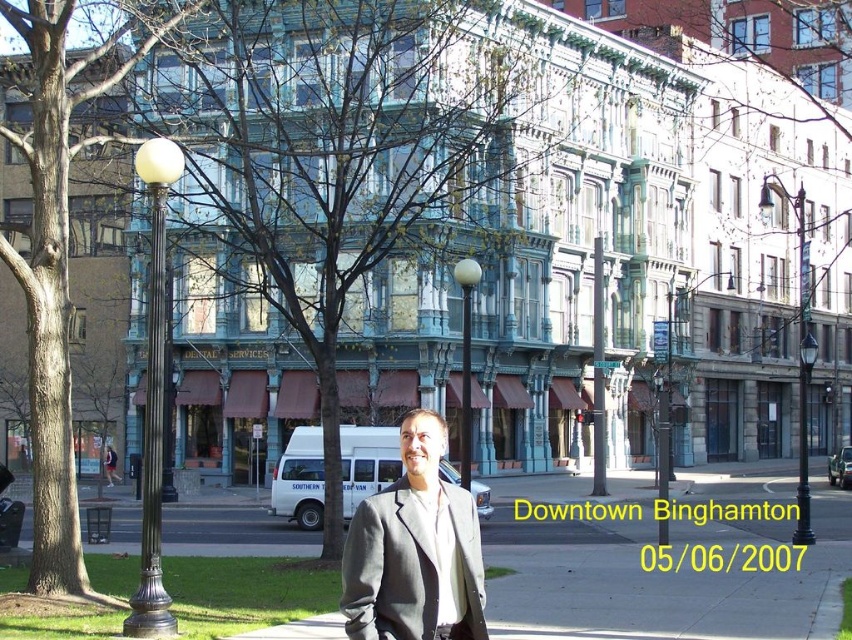
You are a city planner assessing the urban greenery. You need to determine which tree has a bigger canopy to provide more shade. Based on the image, which tree between the green leafy tree at center and the brown wood tree at left should you prioritize for shade provision?

The green leafy tree at center has a larger size compared to the brown wood tree at left, so it should be prioritized for shade provision as it likely has a bigger canopy.

You are a photographer standing at the camera position in the scene. You want to take a closeup photo of the green leafy tree at center. Considering your current distance, would you need to use a zoom lens to get the tree to fill the frame?

The green leafy tree at center is 52.08 meters away from camera. To capture a closeup photo from this distance, you would need to use a zoom lens to bring the tree into focus and fill the frame.

You are a photographer trying to capture a portrait of the gray wool suit at center. There is a brown wood tree at left in the background. Can you tell me which object is taller so I can adjust my camera angle accordingly?

The brown wood tree at left is taller than the gray wool suit at center, so you should position your camera to ensure the tree doesn not block the subject.